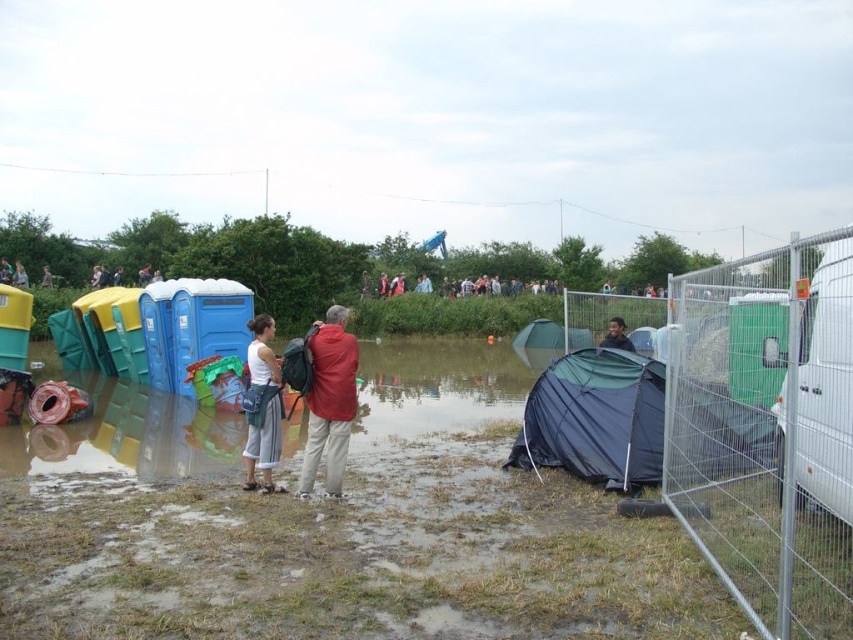
You are a hiker who has just arrived at the flooded campsite. You need to locate the white cotton shirt at center to ask for directions. According to the map coordinates provided, where should you look relative to the portable toilets on the left side?

The white cotton shirt at center is located at coordinates point (20, 275), which is to the right of the portable toilets on the left side.

Based on the scene description, where is the galvanized metal fence at right located in the image?

The galvanized metal fence at right is located at point (767, 429) in the image.